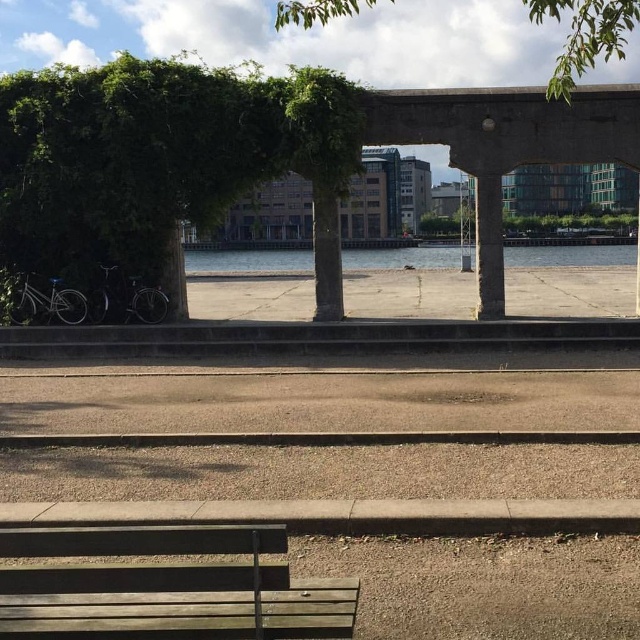
Question: Which object is the closest to the green leafy tree at upper center?

Choices:
 (A) clear water at center
 (B) green leafy tree at left
 (C) wooden bench at lower center

Answer: (C)

Question: Which point is closer to the camera?

Choices:
 (A) (129, 253)
 (B) (209, 570)
 (C) (275, 268)

Answer: (B)

Question: Where is green leafy tree at left located in relation to wooden bench at lower center in the image?

Choices:
 (A) above
 (B) below

Answer: (A)

Question: Is wooden bench at lower center positioned behind green leafy tree at upper center?

Choices:
 (A) no
 (B) yes

Answer: (A)

Question: Which object is farther from the camera taking this photo?

Choices:
 (A) green leafy tree at left
 (B) green leafy tree at upper center

Answer: (A)

Question: Is wooden bench at lower center thinner than clear water at center?

Choices:
 (A) no
 (B) yes

Answer: (B)